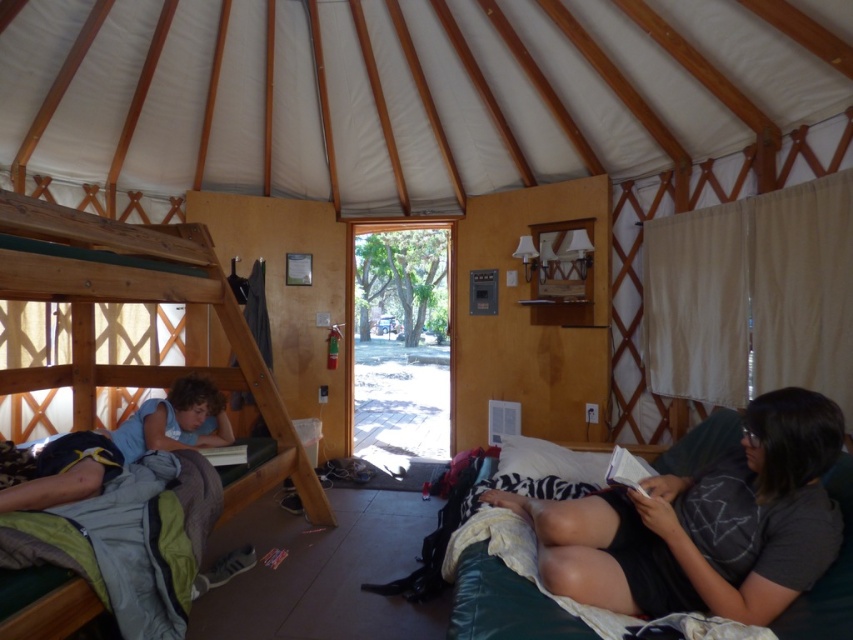
You are standing at the entrance of the yurt and want to pick up the dark gray cotton shirt at lower right. Which direction should you move to reach it?

The dark gray cotton shirt at lower right is located at the lower right area of the yurt, so you should move towards the lower right direction from the entrance to reach it.